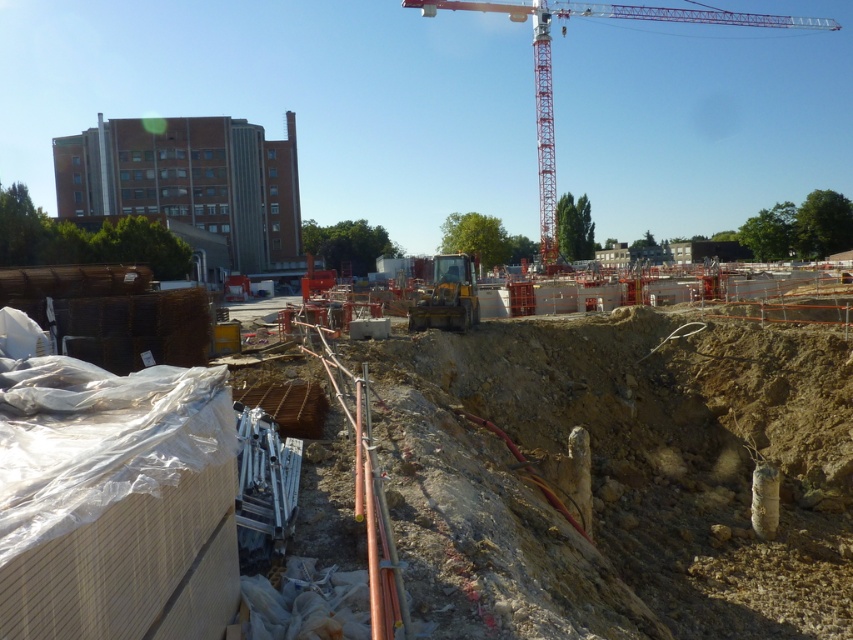
Question: Which point is closer to the camera taking this photo?

Choices:
 (A) click(x=631, y=604)
 (B) click(x=532, y=67)

Answer: (A)

Question: Which point is closer to the camera?

Choices:
 (A) brown dirt at center
 (B) red metallic crane at upper center

Answer: (A)

Question: Is brown dirt at center positioned in front of red metallic crane at upper center?

Choices:
 (A) no
 (B) yes

Answer: (B)

Question: Does brown dirt at center appear on the left side of red metallic crane at upper center?

Choices:
 (A) yes
 (B) no

Answer: (A)

Question: Can you confirm if brown dirt at center is positioned to the left of red metallic crane at upper center?

Choices:
 (A) yes
 (B) no

Answer: (A)

Question: Among these objects, which one is farthest from the camera?

Choices:
 (A) brown dirt at center
 (B) red metallic crane at upper center

Answer: (B)